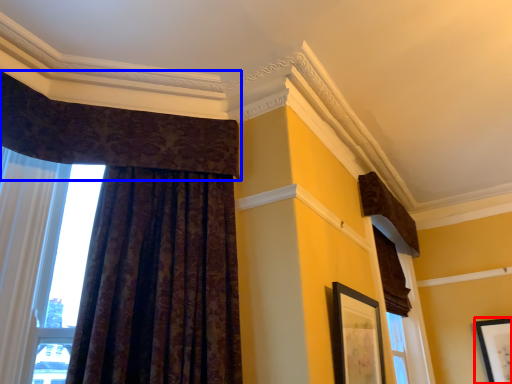
Question: Which object appears closest to the camera in this image, picture frame (highlighted by a red box) or curtain (highlighted by a blue box)?

Choices:
 (A) picture frame
 (B) curtain

Answer: (B)